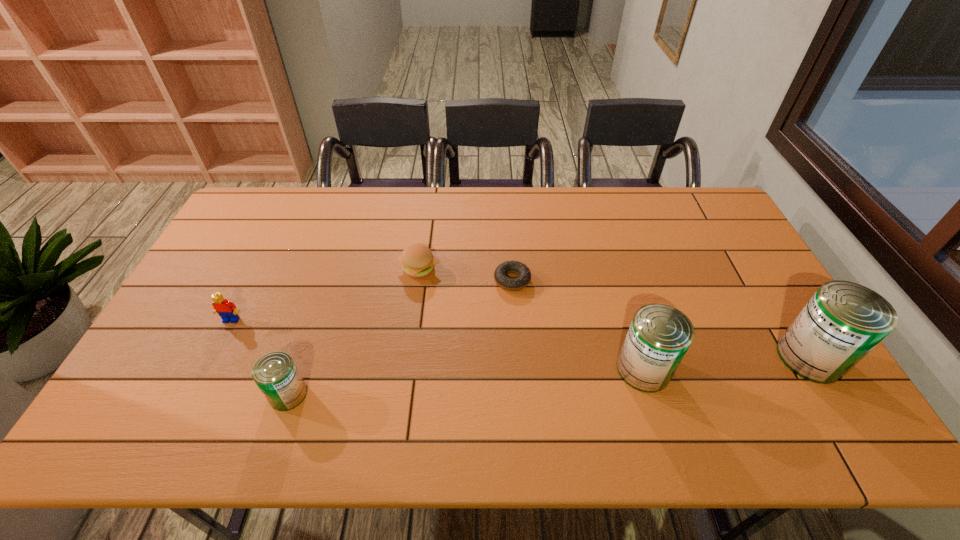
Locate an element on the screen. The width and height of the screenshot is (960, 540). the third object from right to left is located at coordinates (524, 275).

Where is `free region located on the left of the shortest can`? free region located on the left of the shortest can is located at coordinates (184, 394).

This screenshot has width=960, height=540. What are the coordinates of `free spot located on the left of the second object from right to left` in the screenshot? It's located at pyautogui.click(x=563, y=369).

Locate an element on the screen. This screenshot has height=540, width=960. vacant space located 0.360m on the back of the rightmost object is located at coordinates point(741,245).

The width and height of the screenshot is (960, 540). Find the location of `vacant region located on the back of the second shortest object`. vacant region located on the back of the second shortest object is located at coordinates (428, 202).

Where is `vacant space positioned 0.100m on the front-facing side of the third farthest object`? This screenshot has height=540, width=960. vacant space positioned 0.100m on the front-facing side of the third farthest object is located at coordinates (215, 354).

Find the location of a particular element. This screenshot has height=540, width=960. free location located 0.210m on the back of the doughnut is located at coordinates pyautogui.click(x=508, y=225).

Identify the location of object that is at the left edge. Image resolution: width=960 pixels, height=540 pixels. (x=227, y=310).

Image resolution: width=960 pixels, height=540 pixels. What are the coordinates of `object located in the right edge section of the desktop` in the screenshot? It's located at point(843,321).

Find the location of `object that is at the near right corner`. object that is at the near right corner is located at coordinates pyautogui.click(x=843, y=321).